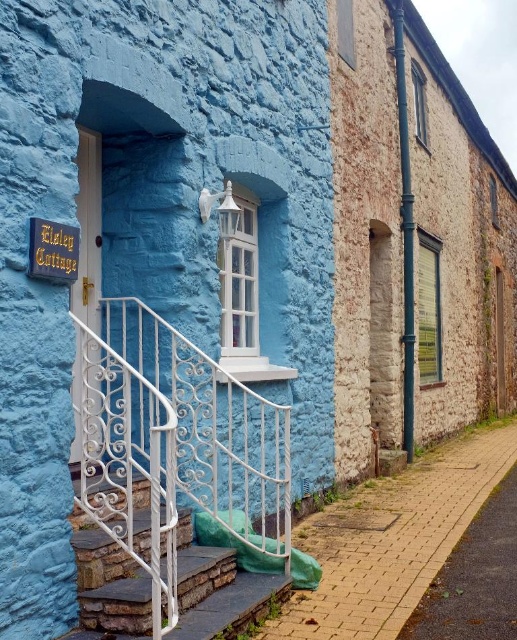
In the scene shown: You are a painter who needs to apply a protective coating to the white wrought iron railing at lower left and the white wrought iron stairs at lower left. You have a spray can that has a maximum effective range of 18 inches. Starting from where you are standing, can you coat both objects without moving closer than 17 inches?

The distance between the white wrought iron railing at lower left and the white wrought iron stairs at lower left is 17.27 inches. Since your spray can reaches up to 18 inches and you need to stay at least 17 inches away, you can position yourself so that both objects fall within the 17 to 18 inch range. Therefore, yes, you can coat both objects without moving closer than 17 inches.

You are a visitor approaching the cottage and want to reach the entrance door. The path leads you to the white wrought iron railing at lower left and the white wrought iron stairs at lower left. Which object should you move towards if you want to ascend to the door?

You should move towards the white wrought iron stairs at lower left because the white wrought iron railing at lower left is to the right of it, meaning the stairs are positioned to the left where the entrance path leads.

You are standing at the entrance of Eisley Cottage and want to place a decorative pot at a specific location marked by the point coordinates. The coordinates given are point (175, 444). Where exactly is this point located relative to the white wrought iron railing at lower left?

The point (175, 444) corresponds to the white wrought iron railing at lower left, so placing the decorative pot there would position it directly on the railing.